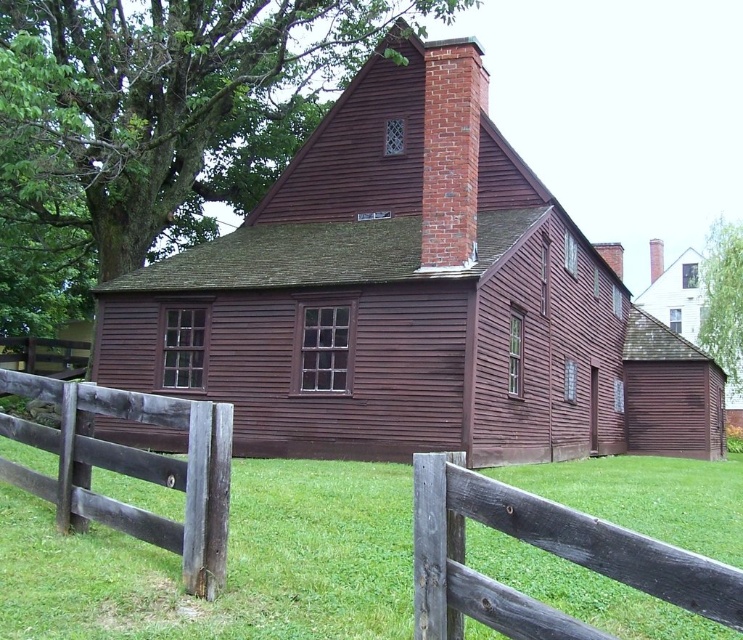
Question: Does matte wooden barn at center appear on the left side of brick chimney at upper center?

Choices:
 (A) yes
 (B) no

Answer: (A)

Question: Is brick chimney at upper center above brick chimney at center?

Choices:
 (A) yes
 (B) no

Answer: (B)

Question: Which of the following is the farthest from the observer?

Choices:
 (A) weathered wood fence at lower left
 (B) brick chimney at upper center
 (C) matte wooden barn at center

Answer: (B)

Question: Which object is positioned closest to the matte wooden barn at center?

Choices:
 (A) weathered wood fence at lower left
 (B) brick chimney at center
 (C) brick chimney at upper center

Answer: (C)

Question: Is matte wooden barn at center thinner than weathered wood fence at lower left?

Choices:
 (A) yes
 (B) no

Answer: (B)

Question: Considering the real-world distances, which object is farthest from the matte wooden barn at center?

Choices:
 (A) brick chimney at center
 (B) gray wooden fence at center
 (C) weathered wood fence at lower left
 (D) white wood barn at upper right

Answer: (A)